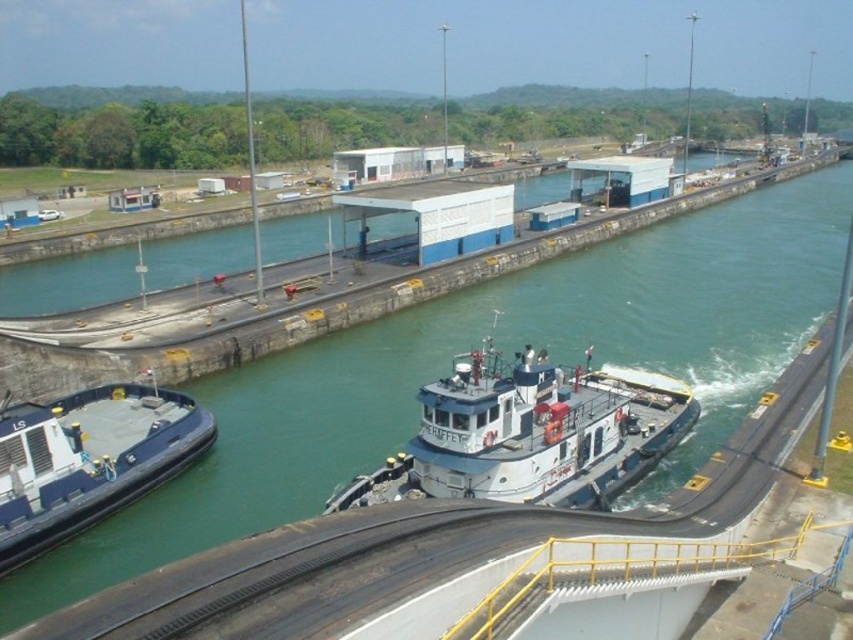
Question: Does white matte tugboat at center appear on the left side of blue rubber boat at left?

Choices:
 (A) yes
 (B) no

Answer: (B)

Question: Does white matte tugboat at center appear over blue rubber boat at left?

Choices:
 (A) yes
 (B) no

Answer: (A)

Question: Which object appears closest to the camera in this image?

Choices:
 (A) blue rubber boat at left
 (B) white matte tugboat at center

Answer: (A)

Question: Does white matte tugboat at center have a larger size compared to blue rubber boat at left?

Choices:
 (A) yes
 (B) no

Answer: (A)

Question: Among these points, which one is nearest to the camera?

Choices:
 (A) (665, 408)
 (B) (28, 509)

Answer: (B)